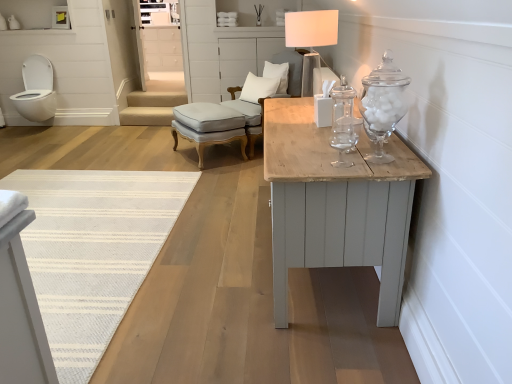
Question: From the image's perspective, is clear glass jar at center located beneath white glossy toilet at left?

Choices:
 (A) no
 (B) yes

Answer: (B)

Question: Does clear glass jar at center have a smaller size compared to white glossy toilet at left?

Choices:
 (A) yes
 (B) no

Answer: (A)

Question: From a real-world perspective, is clear glass jar at center positioned under white glossy toilet at left based on gravity?

Choices:
 (A) yes
 (B) no

Answer: (B)

Question: Is clear glass jar at center shorter than white glossy toilet at left?

Choices:
 (A) no
 (B) yes

Answer: (B)

Question: Is clear glass jar at center facing towards white glossy toilet at left?

Choices:
 (A) no
 (B) yes

Answer: (A)

Question: Would you say white painted wood dresser at upper center is to the left or to the right of clear glass jar at center in the picture?

Choices:
 (A) left
 (B) right

Answer: (A)

Question: Is white painted wood dresser at upper center in front of or behind clear glass jar at center in the image?

Choices:
 (A) front
 (B) behind

Answer: (B)

Question: Is white painted wood dresser at upper center wider or thinner than clear glass jar at center?

Choices:
 (A) wide
 (B) thin

Answer: (B)

Question: From the image's perspective, is white painted wood dresser at upper center located above or below clear glass jar at center?

Choices:
 (A) below
 (B) above

Answer: (B)

Question: From the image's perspective, is light gray fabric stool at center above or below light gray fabric armchair at center?

Choices:
 (A) below
 (B) above

Answer: (A)

Question: Is light gray fabric stool at center inside the boundaries of light gray fabric armchair at center, or outside?

Choices:
 (A) outside
 (B) inside

Answer: (A)

Question: Considering their positions, is light gray fabric stool at center located in front of or behind light gray fabric armchair at center?

Choices:
 (A) behind
 (B) front

Answer: (B)

Question: From a real-world perspective, relative to light gray fabric armchair at center, is light gray fabric stool at center vertically above or below?

Choices:
 (A) above
 (B) below

Answer: (B)

Question: Is point (175, 31) closer or farther from the camera than point (372, 160)?

Choices:
 (A) closer
 (B) farther

Answer: (B)

Question: Considering the positions of white painted wood drawer at upper center and clear glass jar at center in the image, is white painted wood drawer at upper center wider or thinner than clear glass jar at center?

Choices:
 (A) thin
 (B) wide

Answer: (B)